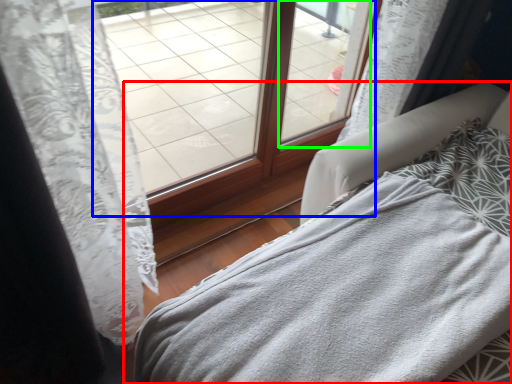
Question: Which object is the farthest from furniture (highlighted by a red box)? Choose among these: window (highlighted by a blue box) or window (highlighted by a green box).

Choices:
 (A) window
 (B) window

Answer: (B)